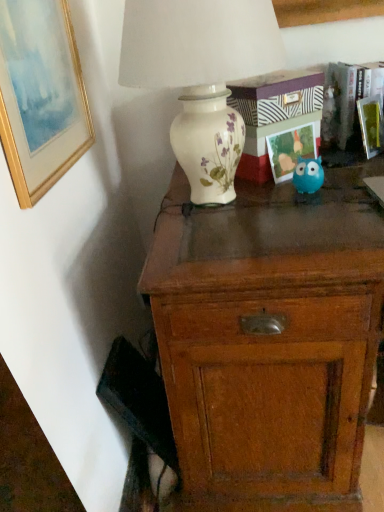
What are the coordinates of `free point below white ceramic vase at upper center (from a real-world perspective)` in the screenshot? It's located at (216, 205).